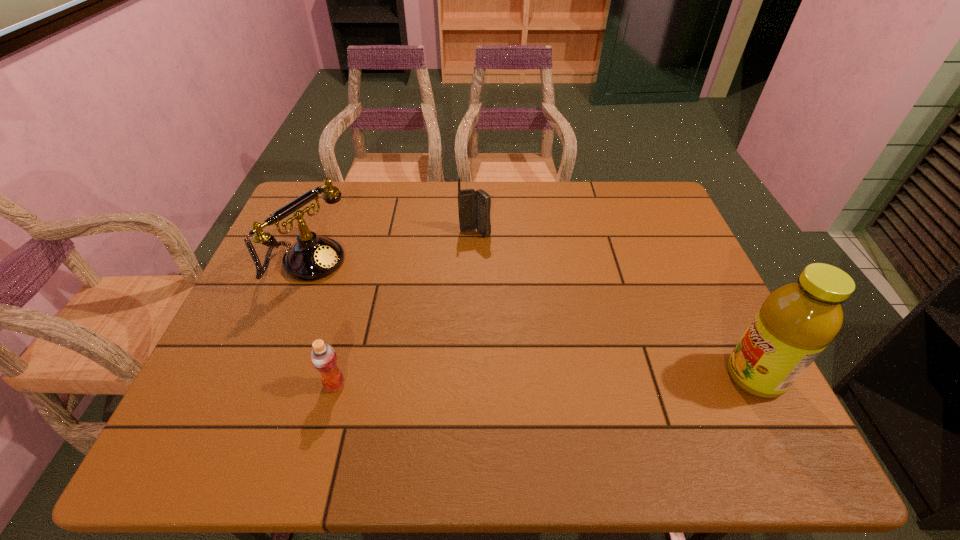
Where is `the shortest object`? This screenshot has height=540, width=960. the shortest object is located at coordinates (323, 357).

Identify the location of the second object from left to right. The height and width of the screenshot is (540, 960). (323, 357).

You are a GUI agent. You are given a task and a screenshot of the screen. Output one action in this format:
    pyautogui.click(x=<x>, y=<y>)
    Task: Click on the tallest object
    
    Given the screenshot: What is the action you would take?
    click(797, 321)

In order to click on fruit juice in this screenshot , I will do `click(797, 321)`.

Find the location of a particular element. Image resolution: width=960 pixels, height=540 pixels. the second object from right to left is located at coordinates (474, 207).

You are a GUI agent. You are given a task and a screenshot of the screen. Output one action in this format:
    pyautogui.click(x=<x>, y=<y>)
    Task: Click on the leftmost object
    The width and height of the screenshot is (960, 540).
    Given the screenshot: What is the action you would take?
    pyautogui.click(x=312, y=257)

Identify the location of vacant space located on the back of the second object from left to right. The height and width of the screenshot is (540, 960). (348, 335).

Find the location of a particular element. Image resolution: width=960 pixels, height=540 pixels. free region located 0.050m on the front label of the tallest object is located at coordinates (703, 376).

Identify the location of blank space located 0.330m on the front label of the tallest object. This screenshot has width=960, height=540. (575, 376).

The height and width of the screenshot is (540, 960). What are the coordinates of `vacant space located on the front label of the tallest object` in the screenshot? It's located at (593, 376).